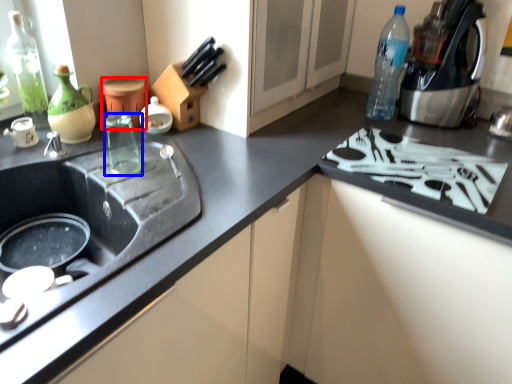
Question: Which point is closer to the camera, appliance (highlighted by a red box) or beverage (highlighted by a blue box)?

Choices:
 (A) appliance
 (B) beverage

Answer: (B)